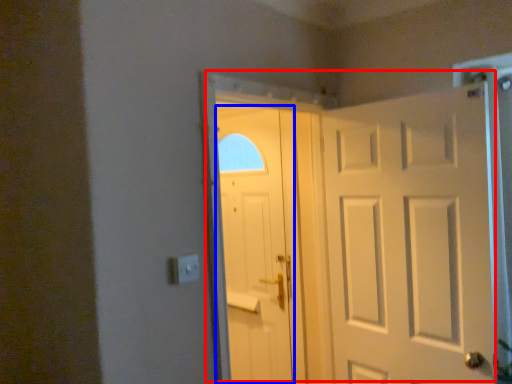
Question: Among these objects, which one is nearest to the camera, door (highlighted by a red box) or door (highlighted by a blue box)?

Choices:
 (A) door
 (B) door

Answer: (A)